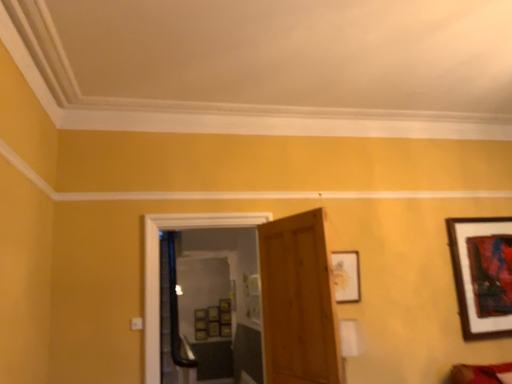
In order to click on wooden picture frame at center-right, marked as the 2th picture frame in a back-to-front arrangement in this screenshot , I will do `click(346, 276)`.

What do you see at coordinates (346, 276) in the screenshot? I see `wooden picture frame at center-right, marked as the 2th picture frame in a back-to-front arrangement` at bounding box center [346, 276].

Identify the location of transparent glass door at center. Image resolution: width=512 pixels, height=384 pixels. (210, 306).

Identify the location of wooden framed artwork at upper right, positioned as the first picture frame in back-to-front order. This screenshot has height=384, width=512. (482, 275).

Is transparent glass door at center facing away from wooden picture frame at center-right, the first picture frame when ordered from front to back?

No, transparent glass door at center is not facing the opposite direction of wooden picture frame at center-right, the first picture frame when ordered from front to back.

Is transparent glass door at center at the right side of wooden picture frame at center-right, the first picture frame when ordered from front to back?

In fact, transparent glass door at center is to the left of wooden picture frame at center-right, the first picture frame when ordered from front to back.

Would you say transparent glass door at center is outside wooden picture frame at center-right, which appears as the first picture frame when viewed from the left?

Yes, transparent glass door at center is not within wooden picture frame at center-right, which appears as the first picture frame when viewed from the left.

Based on the photo, is wooden picture frame at center-right, the first picture frame when ordered from front to back, closer to camera compared to wooden framed artwork at upper right, the second picture frame when ordered from front to back?

Yes.

Considering the positions of points (346, 271) and (454, 255), is point (346, 271) closer to camera compared to point (454, 255)?

That is True.

Is wooden picture frame at center-right, marked as the 2th picture frame in a back-to-front arrangement, thinner than wooden framed artwork at upper right, the second picture frame when ordered from front to back?

In fact, wooden picture frame at center-right, marked as the 2th picture frame in a back-to-front arrangement, might be wider than wooden framed artwork at upper right, the second picture frame when ordered from front to back.

Is wooden picture frame at center-right, which appears as the first picture frame when viewed from the left, oriented away from wooden framed artwork at upper right, the 2th picture frame viewed from the left?

That's not correct — wooden picture frame at center-right, which appears as the first picture frame when viewed from the left, is not looking away from wooden framed artwork at upper right, the 2th picture frame viewed from the left.

You are a GUI agent. You are given a task and a screenshot of the screen. Output one action in this format:
    pyautogui.click(x=<x>, y=<y>)
    Task: Click on the picture frame below the wooden picture frame at center-right, the second picture frame positioned from the right (from a real-world perspective)
    
    Given the screenshot: What is the action you would take?
    (x=482, y=275)

Between wooden framed artwork at upper right, the 2th picture frame viewed from the left, and wooden picture frame at center-right, the second picture frame positioned from the right, which one has more height?

wooden framed artwork at upper right, the 2th picture frame viewed from the left.

From a real-world perspective, is wooden framed artwork at upper right, positioned as the first picture frame in back-to-front order, on top of wooden picture frame at center-right, which appears as the first picture frame when viewed from the left?

No.

Is wooden framed artwork at upper right, positioned as the first picture frame in back-to-front order, positioned with its back to wooden picture frame at center-right, the first picture frame when ordered from front to back?

That's not correct — wooden framed artwork at upper right, positioned as the first picture frame in back-to-front order, is not looking away from wooden picture frame at center-right, the first picture frame when ordered from front to back.

Is point (475, 336) closer to viewer compared to point (287, 284)?

That is False.

Could you tell me if wooden framed artwork at upper right, the second picture frame when ordered from front to back, is facing wooden door at center?

No.

At what (x,y) coordinates should I click in order to perform the action: click on door that appears in front of the wooden framed artwork at upper right, the second picture frame when ordered from front to back. Please return your answer as a coordinate pair (x, y). Looking at the image, I should click on (298, 302).

Is wooden framed artwork at upper right, the 2th picture frame viewed from the left, bigger than wooden door at center?

No.

Are wooden picture frame at center-right, the second picture frame positioned from the right, and wooden door at center far apart?

No, wooden picture frame at center-right, the second picture frame positioned from the right, is not far from wooden door at center.

You are a GUI agent. You are given a task and a screenshot of the screen. Output one action in this format:
    pyautogui.click(x=<x>, y=<y>)
    Task: Click on the door below the wooden picture frame at center-right, which appears as the first picture frame when viewed from the left (from the image's perspective)
    
    Given the screenshot: What is the action you would take?
    pyautogui.click(x=298, y=302)

Considering the sizes of wooden picture frame at center-right, which appears as the first picture frame when viewed from the left, and wooden door at center in the image, is wooden picture frame at center-right, which appears as the first picture frame when viewed from the left, wider or thinner than wooden door at center?

Considering their sizes, wooden picture frame at center-right, which appears as the first picture frame when viewed from the left, looks slimmer than wooden door at center.

Considering the relative positions of wooden picture frame at center-right, the second picture frame positioned from the right, and wooden door at center in the image provided, is wooden picture frame at center-right, the second picture frame positioned from the right, to the right of wooden door at center from the viewer's perspective?

Indeed, wooden picture frame at center-right, the second picture frame positioned from the right, is positioned on the right side of wooden door at center.

How distant is wooden door at center from wooden framed artwork at upper right, the 2th picture frame viewed from the left?

5.99 feet.

Which of these two, wooden door at center or wooden framed artwork at upper right, positioned as the first picture frame in back-to-front order, stands taller?

wooden door at center.

What's the angular difference between wooden door at center and wooden framed artwork at upper right, positioned as the first picture frame in back-to-front order,'s facing directions?

The facing directions of wooden door at center and wooden framed artwork at upper right, positioned as the first picture frame in back-to-front order, are 71.7 degrees apart.

Which point is more forward, (275, 325) or (496, 326)?

Positioned in front is point (275, 325).

From the picture: Is wooden door at center with wooden picture frame at center-right, which appears as the first picture frame when viewed from the left?

No, wooden door at center is not next to wooden picture frame at center-right, which appears as the first picture frame when viewed from the left.

Does point (313, 250) come in front of point (348, 259)?

That is True.

Is wooden door at center positioned before wooden picture frame at center-right, marked as the 2th picture frame in a back-to-front arrangement?

Yes, it is.

The width and height of the screenshot is (512, 384). What are the coordinates of `picture frame that is the 1st one when counting backward from the transparent glass door at center` in the screenshot? It's located at (346, 276).

The width and height of the screenshot is (512, 384). Find the location of `picture frame that is above the wooden framed artwork at upper right, the 1th picture frame viewed from the right (from a real-world perspective)`. picture frame that is above the wooden framed artwork at upper right, the 1th picture frame viewed from the right (from a real-world perspective) is located at coordinates (346, 276).

Considering their positions, is wooden picture frame at center-right, which appears as the first picture frame when viewed from the left, positioned closer to wooden framed artwork at upper right, the 2th picture frame viewed from the left, than transparent glass door at center?

wooden picture frame at center-right, which appears as the first picture frame when viewed from the left.

In the scene shown: Based on their spatial positions, is transparent glass door at center or wooden door at center closer to wooden picture frame at center-right, the second picture frame positioned from the right?

Among the two, wooden door at center is located nearer to wooden picture frame at center-right, the second picture frame positioned from the right.

Considering their positions, is wooden door at center positioned further to transparent glass door at center than wooden framed artwork at upper right, the 2th picture frame viewed from the left?

wooden framed artwork at upper right, the 2th picture frame viewed from the left.

When comparing their distances from wooden framed artwork at upper right, the 1th picture frame viewed from the right, does wooden door at center or transparent glass door at center seem further?

transparent glass door at center is further to wooden framed artwork at upper right, the 1th picture frame viewed from the right.

Considering their positions, is transparent glass door at center positioned further to wooden framed artwork at upper right, the 2th picture frame viewed from the left, than wooden door at center?

The object further to wooden framed artwork at upper right, the 2th picture frame viewed from the left, is transparent glass door at center.

Considering their positions, is wooden door at center positioned further to wooden picture frame at center-right, which appears as the first picture frame when viewed from the left, than transparent glass door at center?

transparent glass door at center is further to wooden picture frame at center-right, which appears as the first picture frame when viewed from the left.

Based on their spatial positions, is transparent glass door at center or wooden framed artwork at upper right, the second picture frame when ordered from front to back, further from wooden door at center?

transparent glass door at center.

Estimate the real-world distances between objects in this image. Which object is further from wooden picture frame at center-right, the first picture frame when ordered from front to back, wooden framed artwork at upper right, the 2th picture frame viewed from the left, or wooden door at center?

Based on the image, wooden framed artwork at upper right, the 2th picture frame viewed from the left, appears to be further to wooden picture frame at center-right, the first picture frame when ordered from front to back.

Identify the location of picture frame between transparent glass door at center and wooden framed artwork at upper right, the 1th picture frame viewed from the right, in the horizontal direction. The image size is (512, 384). (346, 276).

You are a GUI agent. You are given a task and a screenshot of the screen. Output one action in this format:
    pyautogui.click(x=<x>, y=<y>)
    Task: Click on the door between transparent glass door at center and wooden framed artwork at upper right, the 2th picture frame viewed from the left
    The width and height of the screenshot is (512, 384).
    Given the screenshot: What is the action you would take?
    pyautogui.click(x=298, y=302)

The height and width of the screenshot is (384, 512). Find the location of `picture frame located between wooden door at center and wooden framed artwork at upper right, the 1th picture frame viewed from the right, in the left-right direction`. picture frame located between wooden door at center and wooden framed artwork at upper right, the 1th picture frame viewed from the right, in the left-right direction is located at coordinates (346, 276).

At what (x,y) coordinates should I click in order to perform the action: click on door between transparent glass door at center and wooden picture frame at center-right, marked as the 2th picture frame in a back-to-front arrangement. Please return your answer as a coordinate pair (x, y). Looking at the image, I should click on (298, 302).